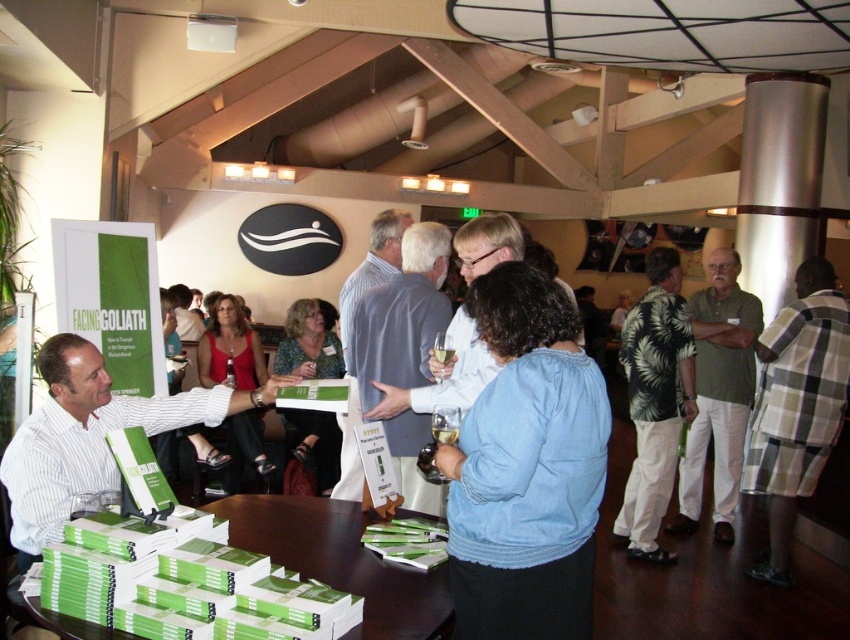
Can you confirm if plaid shirt at right is positioned below blue striped shirt at center?

Correct, plaid shirt at right is located below blue striped shirt at center.

What do you see at coordinates (796, 406) in the screenshot?
I see `plaid shirt at right` at bounding box center [796, 406].

In order to click on plaid shirt at right in this screenshot , I will do `click(796, 406)`.

Who is taller, white striped shirt at left or green paper book at lower center?

Standing taller between the two is white striped shirt at left.

Can you confirm if white striped shirt at left is thinner than green paper book at lower center?

In fact, white striped shirt at left might be wider than green paper book at lower center.

Between point (57, 508) and point (316, 548), which one is positioned behind?

The point (316, 548) is more distant.

You are a GUI agent. You are given a task and a screenshot of the screen. Output one action in this format:
    pyautogui.click(x=<x>, y=<y>)
    Task: Click on the white striped shirt at left
    
    Given the screenshot: What is the action you would take?
    pyautogui.click(x=91, y=435)

Is white striped shirt at left thinner than light blue shirt at center?

In fact, white striped shirt at left might be wider than light blue shirt at center.

Does white striped shirt at left appear on the left side of light blue shirt at center?

Correct, you'll find white striped shirt at left to the left of light blue shirt at center.

Who is more distant from viewer, (83, 364) or (398, 387)?

Point (398, 387)

You are a GUI agent. You are given a task and a screenshot of the screen. Output one action in this format:
    pyautogui.click(x=<x>, y=<y>)
    Task: Click on the white striped shirt at left
    
    Given the screenshot: What is the action you would take?
    pyautogui.click(x=91, y=435)